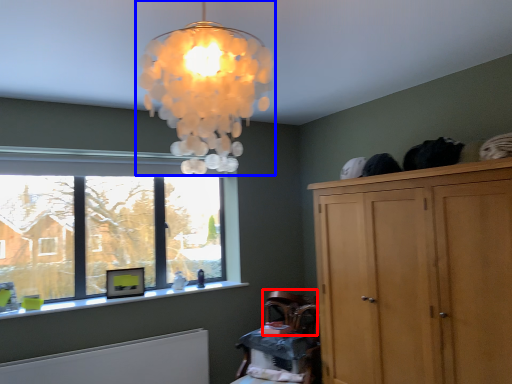
Question: Among these objects, which one is farthest to the camera, armchair (highlighted by a red box) or lamp (highlighted by a blue box)?

Choices:
 (A) armchair
 (B) lamp

Answer: (A)